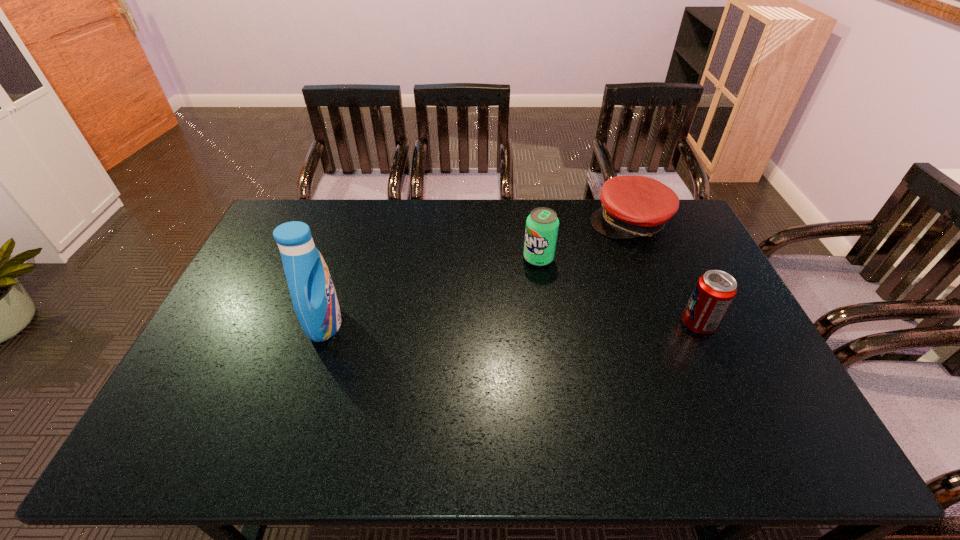
In the image, there is a desktop. Where is `free region at the near edge`? free region at the near edge is located at coordinates (560, 386).

The height and width of the screenshot is (540, 960). Find the location of `vacant space at the left edge of the desktop`. vacant space at the left edge of the desktop is located at coordinates (276, 303).

I want to click on free space at the right edge of the desktop, so click(x=732, y=366).

You are a GUI agent. You are given a task and a screenshot of the screen. Output one action in this format:
    pyautogui.click(x=<x>, y=<y>)
    Task: Click on the free area in between the nearer pop soda and the left pop soda
    The image size is (960, 540).
    Given the screenshot: What is the action you would take?
    pyautogui.click(x=618, y=291)

Identify the location of vacant area between the right pop soda and the leftmost object. This screenshot has width=960, height=540. (512, 324).

Where is `vacant space in between the cap and the right pop soda`? vacant space in between the cap and the right pop soda is located at coordinates (663, 273).

At what (x,y) coordinates should I click in order to perform the action: click on vacant area that lies between the shortest object and the third nearest object. Please return your answer as a coordinate pair (x, y). The width and height of the screenshot is (960, 540). Looking at the image, I should click on (584, 240).

The width and height of the screenshot is (960, 540). I want to click on vacant area that lies between the second object from left to right and the detergent, so click(x=432, y=291).

The width and height of the screenshot is (960, 540). I want to click on unoccupied position between the leftmost object and the farther pop soda, so click(432, 291).

Find the location of `free space between the farther pop soda and the shortest object`. free space between the farther pop soda and the shortest object is located at coordinates (584, 240).